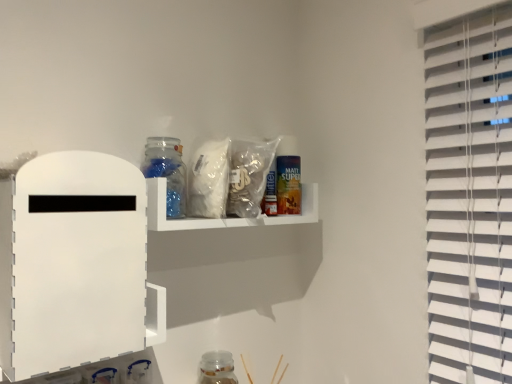
Question: Should I look upward or downward to see transparent glass jar at upper center, the 1th bottle viewed from the front?

Choices:
 (A) up
 (B) down

Answer: (A)

Question: Does translucent plastic bag at upper center contain translucent plastic shelf at upper center, the second shelf positioned from the front?

Choices:
 (A) yes
 (B) no

Answer: (A)

Question: Is translucent plastic bag at upper center oriented towards translucent plastic shelf at upper center, the second shelf positioned from the front?

Choices:
 (A) no
 (B) yes

Answer: (A)

Question: From the image's perspective, is translucent plastic bag at upper center below translucent plastic shelf at upper center, the second shelf positioned from the front?

Choices:
 (A) no
 (B) yes

Answer: (A)

Question: Is translucent plastic shelf at upper center, the second shelf positioned from the front, at the back of translucent plastic bag at upper center?

Choices:
 (A) no
 (B) yes

Answer: (A)

Question: Considering the relative sizes of translucent plastic bag at upper center and translucent plastic shelf at upper center, the 1th shelf when ordered from back to front, in the image provided, is translucent plastic bag at upper center bigger than translucent plastic shelf at upper center, the 1th shelf when ordered from back to front,?

Choices:
 (A) yes
 (B) no

Answer: (A)

Question: Can you confirm if translucent plastic bag at upper center is wider than translucent plastic shelf at upper center, the 1th shelf when ordered from back to front?

Choices:
 (A) no
 (B) yes

Answer: (B)

Question: Would you say transparent glass jar at lower center, marked as the second bottle in a left-to-right arrangement, contains translucent plastic shelf at upper center, which is the first shelf from right to left?

Choices:
 (A) no
 (B) yes

Answer: (A)

Question: Is transparent glass jar at lower center, which is the 1th bottle from bottom to top, positioned with its back to translucent plastic shelf at upper center, the 1th shelf when ordered from back to front?

Choices:
 (A) no
 (B) yes

Answer: (A)

Question: From a real-world perspective, is transparent glass jar at lower center, marked as the second bottle in a left-to-right arrangement, beneath translucent plastic shelf at upper center, marked as the 2th shelf in a left-to-right arrangement?

Choices:
 (A) yes
 (B) no

Answer: (A)

Question: Would you say transparent glass jar at lower center, marked as the second bottle in a left-to-right arrangement, is a long distance from translucent plastic shelf at upper center, the second shelf positioned from the front?

Choices:
 (A) no
 (B) yes

Answer: (A)

Question: Can you confirm if transparent glass jar at lower center, the second bottle viewed from the top, is thinner than translucent plastic shelf at upper center, the 1th shelf when ordered from back to front?

Choices:
 (A) yes
 (B) no

Answer: (A)

Question: Considering the relative positions of transparent glass jar at lower center, the second bottle viewed from the top, and translucent plastic shelf at upper center, which is the first shelf from right to left, in the image provided, is transparent glass jar at lower center, the second bottle viewed from the top, to the right of translucent plastic shelf at upper center, which is the first shelf from right to left, from the viewer's perspective?

Choices:
 (A) yes
 (B) no

Answer: (B)

Question: From the image's perspective, is transparent glass jar at upper center, marked as the first bottle in a top-to-bottom arrangement, on white matte board at left, which is the 2th shelf in back-to-front order?

Choices:
 (A) yes
 (B) no

Answer: (A)